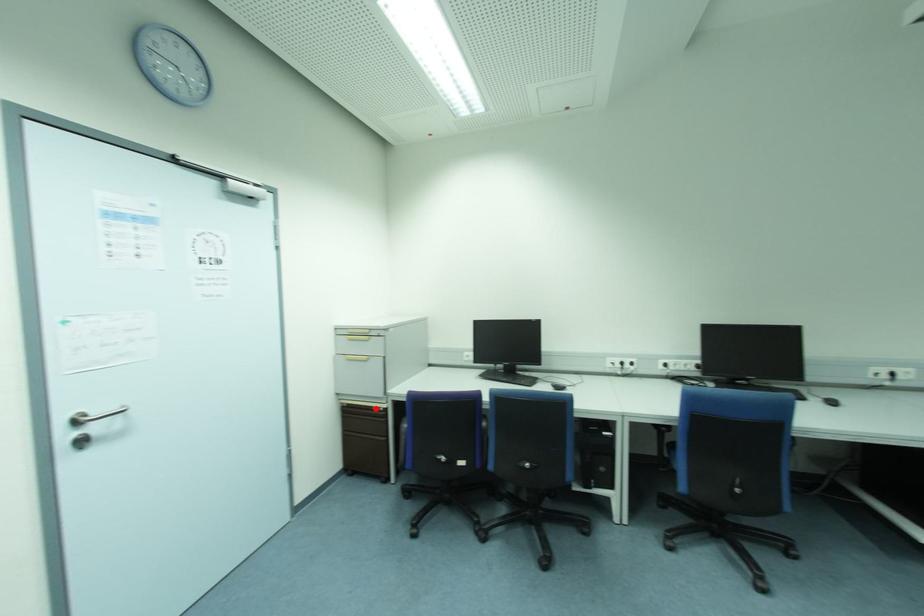
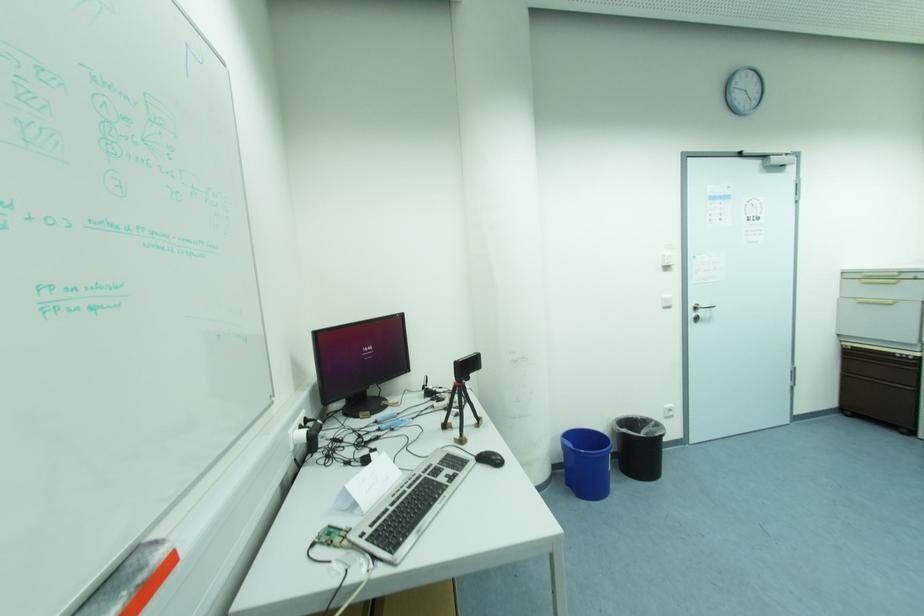
Find the pixel in the second image that matches the highlighted location in the first image.

(898, 355)